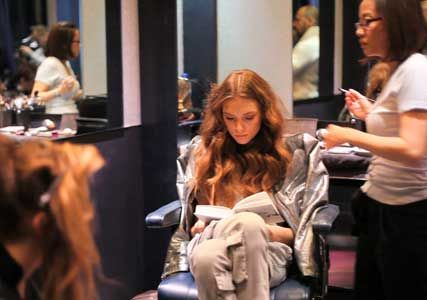
The height and width of the screenshot is (300, 427). In order to click on armrests in this screenshot , I will do `click(159, 216)`, `click(321, 220)`.